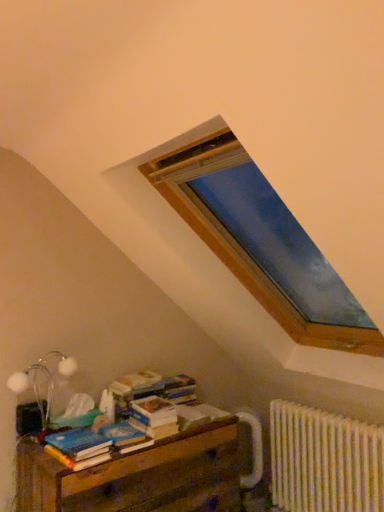
In order to face wooden at lower left, should I rotate leftwards or rightwards?

Rotate left and turn 7.704 degrees.

What do you see at coordinates (123, 434) in the screenshot? I see `blue matte paperback book at lower left, the second paperback book positioned from the left` at bounding box center [123, 434].

What do you see at coordinates (43, 381) in the screenshot? I see `white matte table lamp at lower left` at bounding box center [43, 381].

Locate an element on the screen. This screenshot has width=384, height=512. white paper at center, placed as the first paperback book when sorted from right to left is located at coordinates (198, 415).

I want to click on blue matte paperback book at lower left, the third paperback book from the right, so [78, 443].

Measure the distance from wooden at lower left to white textured radiator at lower right.

wooden at lower left is 28.41 inches away from white textured radiator at lower right.

Between wooden at lower left and white textured radiator at lower right, which one is positioned behind?

white textured radiator at lower right is further from the camera.

How different are the orientations of wooden at lower left and white textured radiator at lower right in degrees?

They differ by 89.2 degrees in their facing directions.

Considering the sizes of objects wooden at lower left and white textured radiator at lower right in the image provided, who is smaller, wooden at lower left or white textured radiator at lower right?

white textured radiator at lower right is smaller.

Does point (310, 466) come closer to viewer compared to point (207, 404)?

Yes, point (310, 466) is closer to viewer.

Is white textured radiator at lower right further to camera compared to white paper at center, the third paperback book in the left-to-right sequence?

No, white textured radiator at lower right is closer to the viewer.

Consider the image. Based on their sizes in the image, would you say white textured radiator at lower right is bigger or smaller than white paper at center, placed as the first paperback book when sorted from right to left?

In the image, white textured radiator at lower right appears to be larger than white paper at center, placed as the first paperback book when sorted from right to left.

Which is more to the right, white textured radiator at lower right or blue matte paperback book at lower left, the third paperback book from the right?

white textured radiator at lower right.

Is white textured radiator at lower right not within blue matte paperback book at lower left, the first paperback book viewed from the left?

Yes, white textured radiator at lower right is located beyond the bounds of blue matte paperback book at lower left, the first paperback book viewed from the left.

From the image's perspective, is white textured radiator at lower right below blue matte paperback book at lower left, the third paperback book from the right?

Yes, from the image's perspective, white textured radiator at lower right is beneath blue matte paperback book at lower left, the third paperback book from the right.

Is blue matte paperback book at lower left, the second paperback book positioned from the left, in front of or behind wooden at lower left in the image?

Clearly, blue matte paperback book at lower left, the second paperback book positioned from the left, is behind wooden at lower left.

From the image's perspective, is blue matte paperback book at lower left, which ranks as the 2th paperback book in right-to-left order, on top of wooden at lower left?

Yes, from the image's perspective, blue matte paperback book at lower left, which ranks as the 2th paperback book in right-to-left order, is above wooden at lower left.

In the scene shown: Can you tell me how much blue matte paperback book at lower left, the second paperback book positioned from the left, and wooden at lower left differ in facing direction?

The angular difference between blue matte paperback book at lower left, the second paperback book positioned from the left, and wooden at lower left is 0.000346 degrees.

How many degrees apart are the facing directions of blue matte paperback book at lower left, which ranks as the 2th paperback book in right-to-left order, and white textured radiator at lower right?

The angle between the facing direction of blue matte paperback book at lower left, which ranks as the 2th paperback book in right-to-left order, and the facing direction of white textured radiator at lower right is 89.2 degrees.

Consider the image. Is blue matte paperback book at lower left, which ranks as the 2th paperback book in right-to-left order, situated inside white textured radiator at lower right or outside?

blue matte paperback book at lower left, which ranks as the 2th paperback book in right-to-left order, is spatially situated outside white textured radiator at lower right.

Who is shorter, blue matte paperback book at lower left, the second paperback book positioned from the left, or white textured radiator at lower right?

With less height is blue matte paperback book at lower left, the second paperback book positioned from the left.

Is blue matte paperback book at lower left, which ranks as the 2th paperback book in right-to-left order, in front of or behind white textured radiator at lower right in the image?

Clearly, blue matte paperback book at lower left, which ranks as the 2th paperback book in right-to-left order, is in front of white textured radiator at lower right.

Is blue matte paperback book at lower left, which ranks as the 2th paperback book in right-to-left order, at the back of white paper at center, the third paperback book in the left-to-right sequence?

No, white paper at center, the third paperback book in the left-to-right sequence, is not facing away from blue matte paperback book at lower left, which ranks as the 2th paperback book in right-to-left order.

Considering the points (218, 413) and (111, 438), which point is behind, point (218, 413) or point (111, 438)?

The point (218, 413) is farther from the camera.

From the image's perspective, is white paper at center, placed as the first paperback book when sorted from right to left, on top of blue matte paperback book at lower left, which ranks as the 2th paperback book in right-to-left order?

No, from the image's perspective, white paper at center, placed as the first paperback book when sorted from right to left, is not on top of blue matte paperback book at lower left, which ranks as the 2th paperback book in right-to-left order.

Which object is positioned more to the right, white paper at center, the third paperback book in the left-to-right sequence, or blue matte paperback book at lower left, the second paperback book positioned from the left?

white paper at center, the third paperback book in the left-to-right sequence, is more to the right.

From a real-world perspective, is blue matte paperback book at lower left, the first paperback book viewed from the left, located higher than blue matte paperback book at lower left, which ranks as the 2th paperback book in right-to-left order?

Yes.

Does blue matte paperback book at lower left, the third paperback book from the right, appear on the left side of blue matte paperback book at lower left, the second paperback book positioned from the left?

Indeed, blue matte paperback book at lower left, the third paperback book from the right, is positioned on the left side of blue matte paperback book at lower left, the second paperback book positioned from the left.

Does blue matte paperback book at lower left, the third paperback book from the right, have a lesser width compared to blue matte paperback book at lower left, which ranks as the 2th paperback book in right-to-left order?

Yes, blue matte paperback book at lower left, the third paperback book from the right, is thinner than blue matte paperback book at lower left, which ranks as the 2th paperback book in right-to-left order.

Is blue matte paperback book at lower left, the third paperback book from the right, turned away from blue matte paperback book at lower left, the second paperback book positioned from the left?

No, blue matte paperback book at lower left, the third paperback book from the right, is not facing the opposite direction of blue matte paperback book at lower left, the second paperback book positioned from the left.

Where is `nightstand above the white textured radiator at lower right (from a real-world perspective)`? The image size is (384, 512). nightstand above the white textured radiator at lower right (from a real-world perspective) is located at coordinates [139, 476].

Locate an element on the screen. The image size is (384, 512). radiator that is in front of the white paper at center, placed as the first paperback book when sorted from right to left is located at coordinates (324, 461).

Considering their positions, is wooden at lower left positioned closer to white matte table lamp at lower left than blue matte paperback book at lower left, which ranks as the 2th paperback book in right-to-left order?

The object closer to white matte table lamp at lower left is blue matte paperback book at lower left, which ranks as the 2th paperback book in right-to-left order.

Which object lies further to the anchor point white textured radiator at lower right, wooden at lower left or blue matte paperback book at lower left, which ranks as the 2th paperback book in right-to-left order?

The object further to white textured radiator at lower right is blue matte paperback book at lower left, which ranks as the 2th paperback book in right-to-left order.

Looking at the image, which one is located closer to blue matte paperback book at lower left, the first paperback book viewed from the left, white paper at center, placed as the first paperback book when sorted from right to left, or white matte table lamp at lower left?

white matte table lamp at lower left lies closer to blue matte paperback book at lower left, the first paperback book viewed from the left, than the other object.

Which object lies further to the anchor point white paper at center, the third paperback book in the left-to-right sequence, white matte table lamp at lower left or blue matte paperback book at lower left, the third paperback book from the right?

→ white matte table lamp at lower left is positioned further to the anchor white paper at center, the third paperback book in the left-to-right sequence.

Looking at the image, which one is located closer to blue matte paperback book at lower left, the first paperback book viewed from the left, white paper at center, placed as the first paperback book when sorted from right to left, or blue matte paperback book at lower left, which ranks as the 2th paperback book in right-to-left order?

blue matte paperback book at lower left, which ranks as the 2th paperback book in right-to-left order, lies closer to blue matte paperback book at lower left, the first paperback book viewed from the left, than the other object.

From the image, which object appears to be farther from white textured radiator at lower right, blue matte paperback book at lower left, which ranks as the 2th paperback book in right-to-left order, or blue matte paperback book at lower left, the first paperback book viewed from the left?

blue matte paperback book at lower left, the first paperback book viewed from the left, is further to white textured radiator at lower right.

Looking at the image, which one is located further to wooden at lower left, white matte table lamp at lower left or blue matte paperback book at lower left, which ranks as the 2th paperback book in right-to-left order?

Among the two, white matte table lamp at lower left is located further to wooden at lower left.

Estimate the real-world distances between objects in this image. Which object is closer to white textured radiator at lower right, wooden at lower left or blue matte paperback book at lower left, the first paperback book viewed from the left?

wooden at lower left.

Locate an element on the screen. paperback book between white matte table lamp at lower left and blue matte paperback book at lower left, which ranks as the 2th paperback book in right-to-left order, from left to right is located at coordinates (78, 443).

Locate an element on the screen. The width and height of the screenshot is (384, 512). nightstand situated between white matte table lamp at lower left and white textured radiator at lower right from left to right is located at coordinates (139, 476).

I want to click on paperback book between blue matte paperback book at lower left, the third paperback book from the right, and white paper at center, the third paperback book in the left-to-right sequence, so click(123, 434).

You are a GUI agent. You are given a task and a screenshot of the screen. Output one action in this format:
    pyautogui.click(x=<x>, y=<y>)
    Task: Click on the paperback book between wooden at lower left and white textured radiator at lower right from left to right
    Image resolution: width=384 pixels, height=512 pixels.
    Given the screenshot: What is the action you would take?
    pyautogui.click(x=198, y=415)